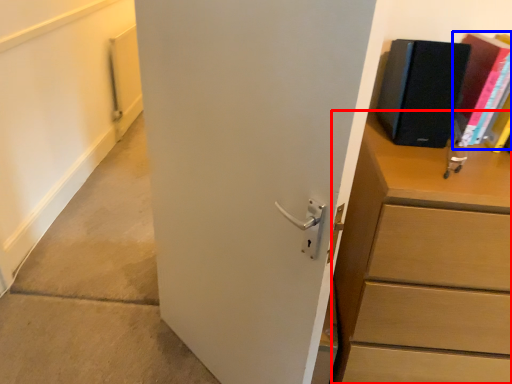
Question: Which object is further to the camera taking this photo, chest of drawers (highlighted by a red box) or paperback book (highlighted by a blue box)?

Choices:
 (A) chest of drawers
 (B) paperback book

Answer: (B)